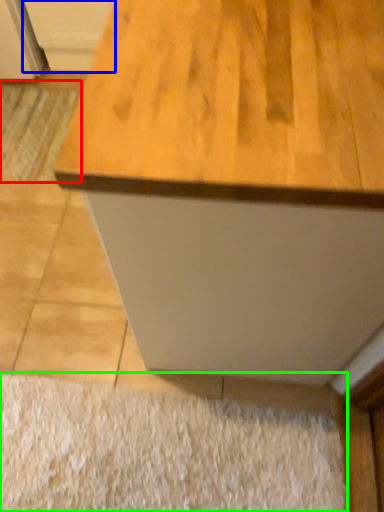
Question: Which object is positioned farthest from doormat (highlighted by a red box)? Select from cabinetry (highlighted by a blue box) and doormat (highlighted by a green box).

Choices:
 (A) cabinetry
 (B) doormat

Answer: (B)